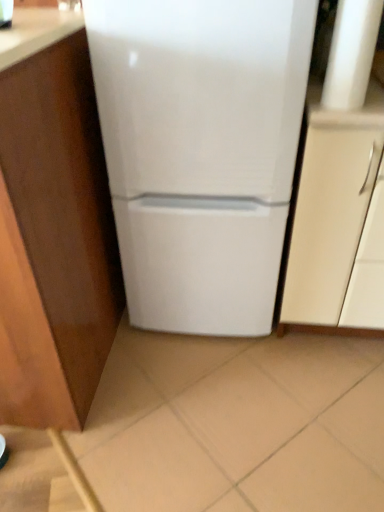
Question: Is white glossy refrigerator at center directly adjacent to matte white cabinet at right, positioned as the first cabinetry in right-to-left order?

Choices:
 (A) no
 (B) yes

Answer: (A)

Question: Is white glossy refrigerator at center located outside matte white cabinet at right, which appears as the 2th cabinetry when viewed from the left?

Choices:
 (A) yes
 (B) no

Answer: (A)

Question: Does white glossy refrigerator at center lie behind matte white cabinet at right, which appears as the 2th cabinetry when viewed from the left?

Choices:
 (A) yes
 (B) no

Answer: (B)

Question: Considering the relative sizes of white glossy refrigerator at center and matte white cabinet at right, positioned as the first cabinetry in right-to-left order, in the image provided, is white glossy refrigerator at center smaller than matte white cabinet at right, positioned as the first cabinetry in right-to-left order,?

Choices:
 (A) yes
 (B) no

Answer: (A)

Question: From a real-world perspective, is white glossy refrigerator at center located higher than matte white cabinet at right, positioned as the first cabinetry in right-to-left order?

Choices:
 (A) no
 (B) yes

Answer: (B)

Question: From the image's perspective, is matte white cabinet at right, which appears as the 2th cabinetry when viewed from the left, above or below white glossy refrigerator at center?

Choices:
 (A) below
 (B) above

Answer: (A)

Question: Looking at their shapes, would you say matte white cabinet at right, which appears as the 2th cabinetry when viewed from the left, is wider or thinner than white glossy refrigerator at center?

Choices:
 (A) thin
 (B) wide

Answer: (B)

Question: Considering the positions of point (342, 126) and point (210, 286), is point (342, 126) closer or farther from the camera than point (210, 286)?

Choices:
 (A) closer
 (B) farther

Answer: (A)

Question: Considering the relative positions of matte white cabinet at right, which appears as the 2th cabinetry when viewed from the left, and white glossy refrigerator at center in the image provided, is matte white cabinet at right, which appears as the 2th cabinetry when viewed from the left, to the left or to the right of white glossy refrigerator at center?

Choices:
 (A) right
 (B) left

Answer: (A)

Question: From a real-world perspective, is wooden cabinet at left, positioned as the second cabinetry in right-to-left order, positioned above or below white glossy refrigerator at center?

Choices:
 (A) below
 (B) above

Answer: (A)

Question: Is wooden cabinet at left, positioned as the second cabinetry in right-to-left order, situated inside white glossy refrigerator at center or outside?

Choices:
 (A) inside
 (B) outside

Answer: (B)

Question: From the image's perspective, relative to white glossy refrigerator at center, is wooden cabinet at left, positioned as the second cabinetry in right-to-left order, above or below?

Choices:
 (A) below
 (B) above

Answer: (A)

Question: Is wooden cabinet at left, positioned as the second cabinetry in right-to-left order, bigger or smaller than white glossy refrigerator at center?

Choices:
 (A) small
 (B) big

Answer: (B)

Question: Considering the relative positions of white glossy refrigerator at center and matte white cabinet at right, which appears as the 2th cabinetry when viewed from the left, in the image provided, is white glossy refrigerator at center to the left or to the right of matte white cabinet at right, which appears as the 2th cabinetry when viewed from the left,?

Choices:
 (A) right
 (B) left

Answer: (B)

Question: From a real-world perspective, relative to matte white cabinet at right, which appears as the 2th cabinetry when viewed from the left, is white glossy refrigerator at center vertically above or below?

Choices:
 (A) below
 (B) above

Answer: (B)